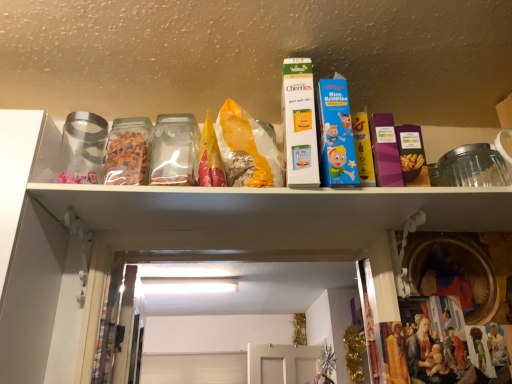
Question: Considering the relative positions of white cardboard cheerios box at upper center, marked as the second product in a right-to-left arrangement, and transparent plastic container at center in the image provided, is white cardboard cheerios box at upper center, marked as the second product in a right-to-left arrangement, to the left or to the right of transparent plastic container at center?

Choices:
 (A) right
 (B) left

Answer: (A)

Question: Relative to transparent plastic container at center, is white cardboard cheerios box at upper center, marked as the second product in a right-to-left arrangement, in front or behind?

Choices:
 (A) behind
 (B) front

Answer: (B)

Question: Considering the real-world distances, which object is farthest from the transparent plastic container at center?

Choices:
 (A) blue cardboard rice krispies cereal box at center, which is the second product in left-to-right order
 (B) white cardboard cheerios box at upper center, marked as the second product in a right-to-left arrangement

Answer: (A)

Question: Which object is positioned farthest from the white cardboard cheerios box at upper center, marked as the second product in a right-to-left arrangement?

Choices:
 (A) transparent plastic container at center
 (B) blue cardboard rice krispies cereal box at center, the 1th product viewed from the right

Answer: (A)